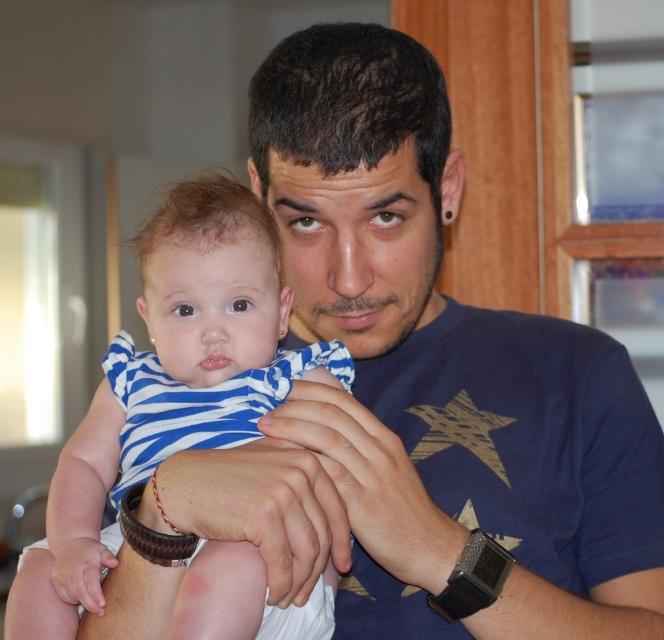
Can you confirm if blue striped fabric baby at center is positioned above black leather watch at center?

Indeed, blue striped fabric baby at center is positioned over black leather watch at center.

Is point (68, 449) positioned before point (353, 461)?

That is False.

Who is more distant from viewer, (84,605) or (373,490)?

Positioned behind is point (373,490).

Where is `blue striped fabric baby at center`? blue striped fabric baby at center is located at coordinates (187, 356).